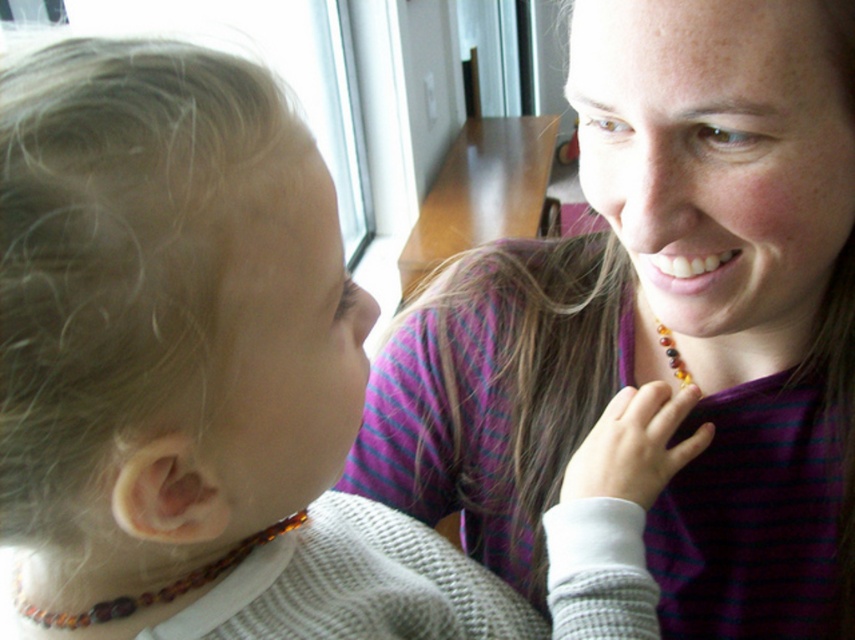
You are a photographer trying to capture the exact center of the image. You notice the matte amber necklace at center is slightly off the center. Can you determine if it is to the left or right of the true center?

The position of matte amber necklace at center is at point 0.502 on the x axis, which is very slightly to the right of the true center at 0.5. Therefore, the matte amber necklace at center is positioned to the right of the true center.